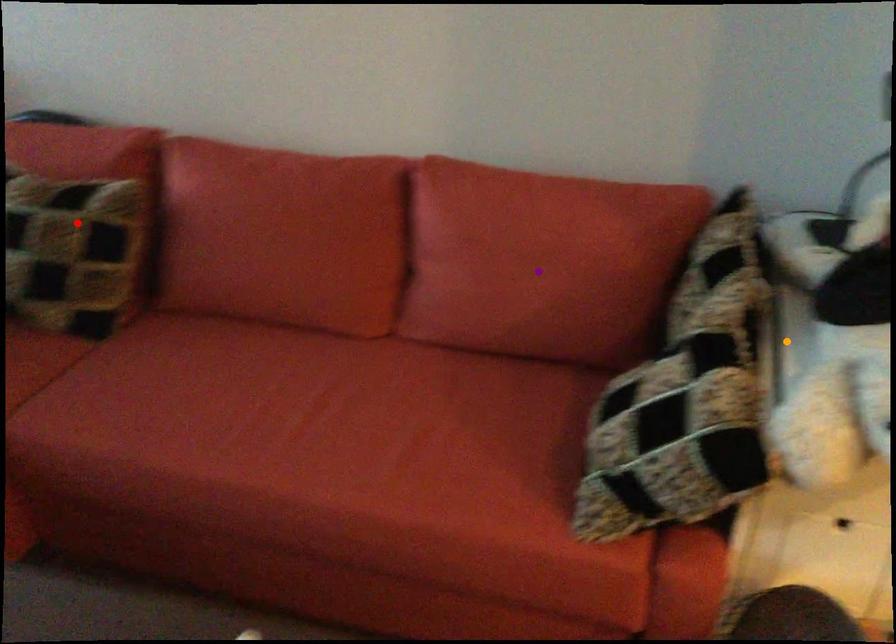
Order these from farthest to nearest:
purple point, red point, orange point

red point
purple point
orange point